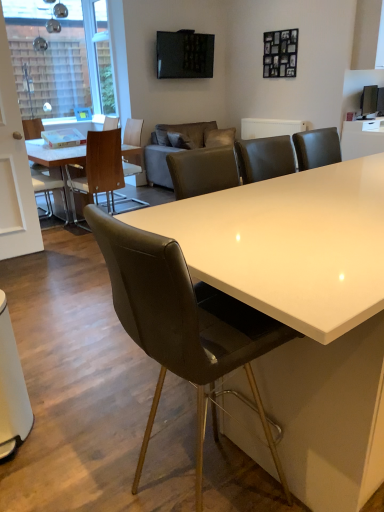
In order to click on vacant area that lies between leather at center, placed as the fourth chair when sorted from back to front, and white glossy door at left in this screenshot , I will do pos(91,349).